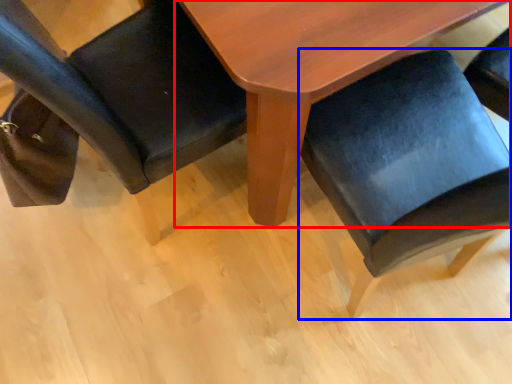
Question: Which point is closer to the camera, table (highlighted by a red box) or chair (highlighted by a blue box)?

Choices:
 (A) table
 (B) chair

Answer: (B)